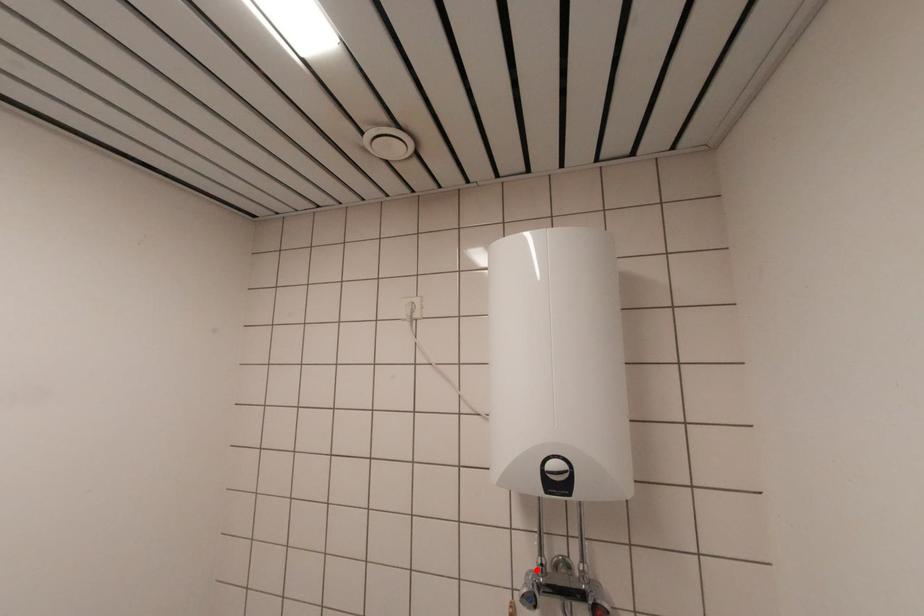
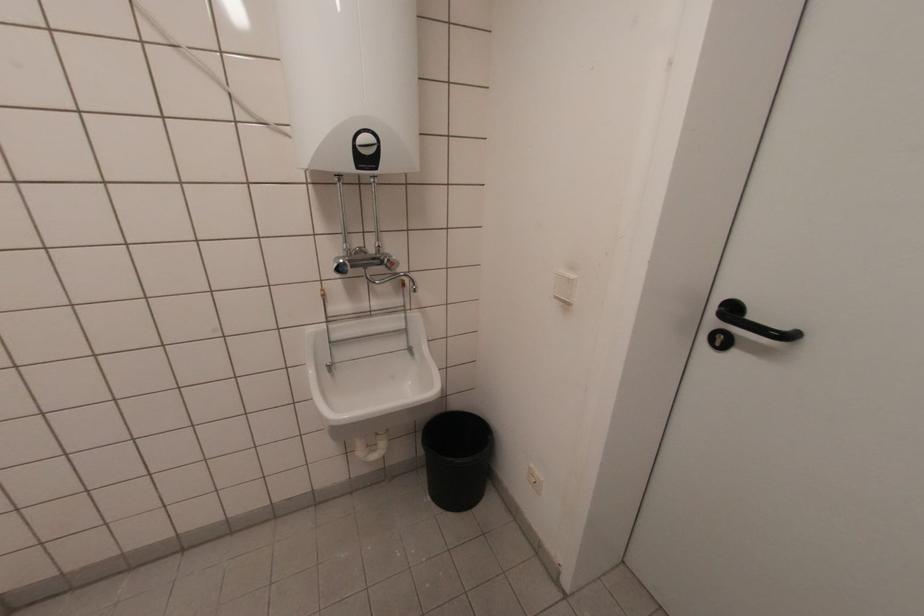
Where in the second image is the point corresponding to the highlighted location from the first image?

(343, 254)